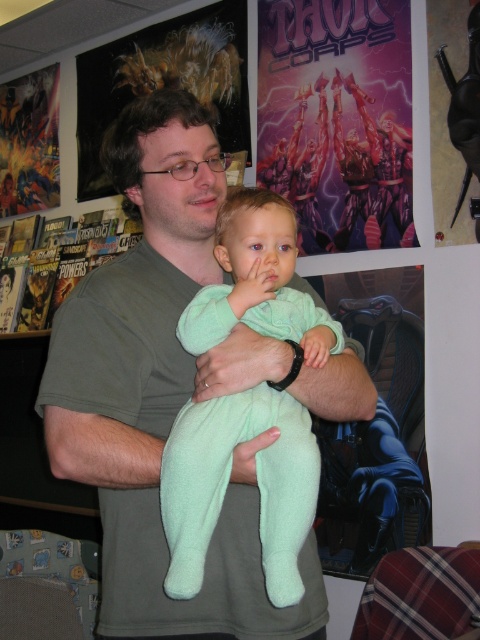
This screenshot has height=640, width=480. What do you see at coordinates (337, 120) in the screenshot?
I see `purple matte poster at upper center` at bounding box center [337, 120].

Does point (331, 216) lie behind point (33, 179)?

No, (331, 216) is closer to viewer.

Does point (330, 97) lie in front of point (3, 140)?

Yes, it is in front of point (3, 140).

This screenshot has width=480, height=640. I want to click on purple matte poster at upper center, so click(x=337, y=120).

Is green fleece shirt at center below mint fleece onesie at center?

No, green fleece shirt at center is not below mint fleece onesie at center.

The width and height of the screenshot is (480, 640). What do you see at coordinates (172, 388) in the screenshot?
I see `green fleece shirt at center` at bounding box center [172, 388].

Does point (277, 365) lie behind point (220, 291)?

No, it is in front of (220, 291).

I want to click on green fleece shirt at center, so click(172, 388).

In the scene shown: Is mint fleece onesie at center shorter than purple matte poster at upper center?

Yes, mint fleece onesie at center is shorter than purple matte poster at upper center.

Between mint fleece onesie at center and purple matte poster at upper center, which one appears on the right side from the viewer's perspective?

purple matte poster at upper center

Find the location of `mint fleece onesie at center`. mint fleece onesie at center is located at coordinates (228, 481).